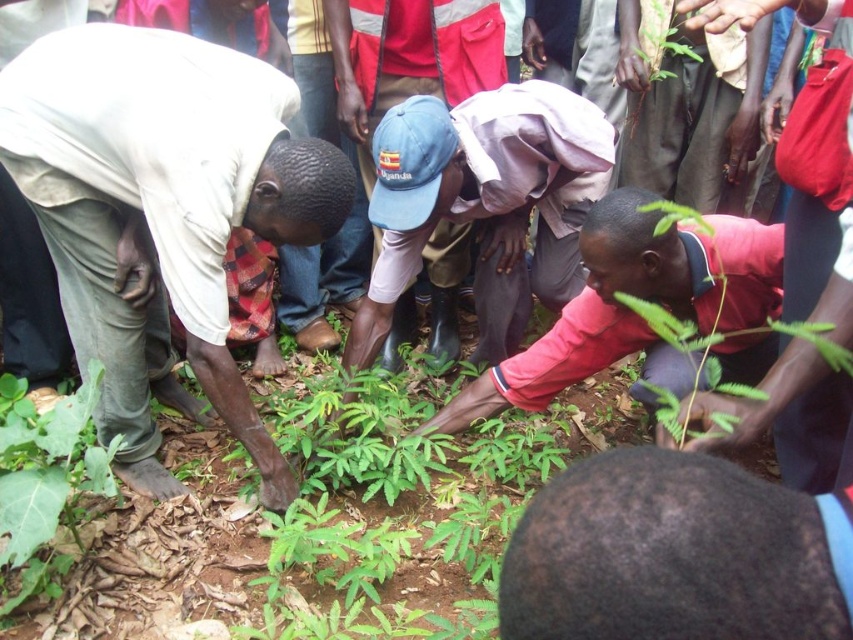
You are a photographer standing in the garden and want to take a photo of the blue rubber boots at center and the green leafy plant at lower left. Which object will appear larger in the photo?

The blue rubber boots at center will appear larger in the photo because it is closer to the viewer than the green leafy plant at lower left.

Where is the blue rubber boots at center located in the image?

The blue rubber boots at center is located at point (x=483, y=198) in the image.

You are a photographer trying to capture a photo of the blue rubber boots at center and the green leafy plant at upper right. To ensure both are in frame, which object should you position closer to the camera?

The blue rubber boots at center should be positioned closer to the camera because it is located to the left of the green leafy plant at upper right, so adjusting their position can help frame both objects effectively.